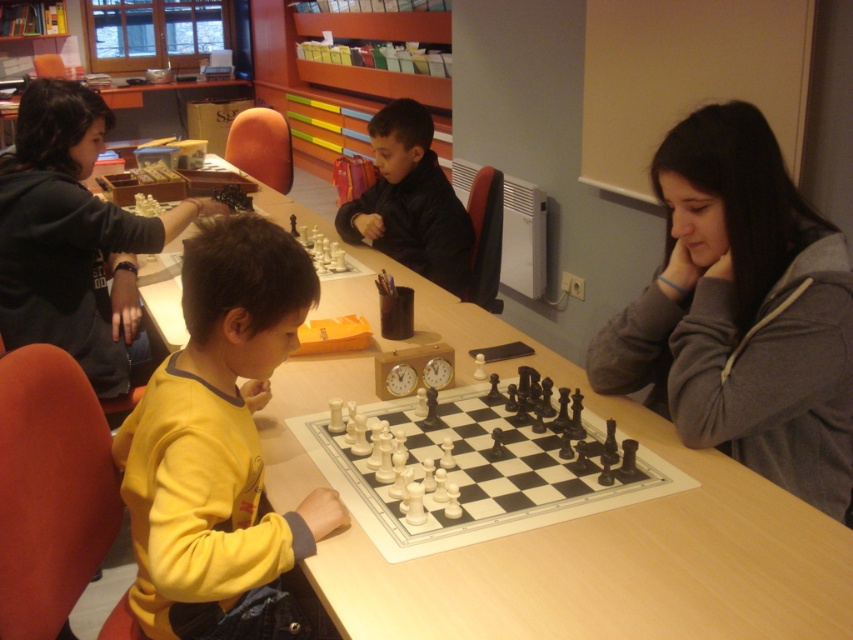
Does point (228, 532) come in front of point (538, 522)?

Yes, it is in front of point (538, 522).

Does yellow fleece at center lie behind black plastic chess set at center?

That is False.

Does point (228, 257) come in front of point (351, 499)?

Yes, it is.

Image resolution: width=853 pixels, height=640 pixels. Identify the location of yellow fleece at center. (219, 445).

Who is positioned more to the right, dark gray hoodie at left or black matte jacket at center?

Positioned to the right is black matte jacket at center.

Describe the element at coordinates (73, 237) in the screenshot. This screenshot has height=640, width=853. I see `dark gray hoodie at left` at that location.

Between point (51, 317) and point (386, 104), which one is positioned behind?

Point (386, 104)

At what (x,y) coordinates should I click in order to perform the action: click on dark gray hoodie at left. Please return your answer as a coordinate pair (x, y). This screenshot has height=640, width=853. Looking at the image, I should click on (73, 237).

Does gray fleece hoodie at center lie behind black matte jacket at center?

No, gray fleece hoodie at center is closer to the viewer.

Can you confirm if gray fleece hoodie at center is bigger than black matte jacket at center?

Indeed, gray fleece hoodie at center has a larger size compared to black matte jacket at center.

Is point (669, 250) positioned behind point (373, 116)?

No.

What are the coordinates of `gray fleece hoodie at center` in the screenshot? It's located at (741, 312).